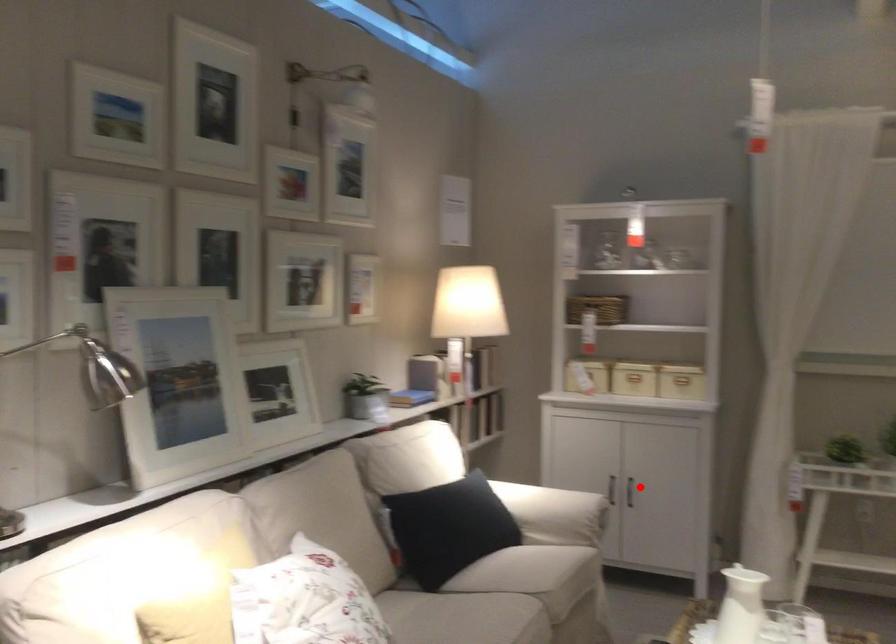
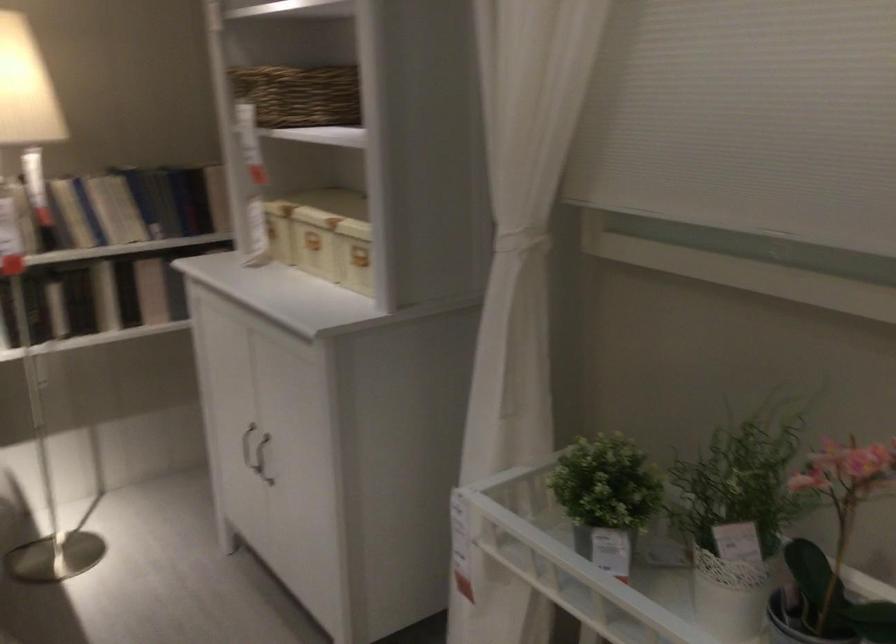
Question: I am providing you with two images of the same scene from different viewpoints. Image1 has a red point marked. In image2, the corresponding 3D location appears at what relative position? Reply with the corresponding letter.

Choices:
 (A) Closer
 (B) Farther

Answer: (A)